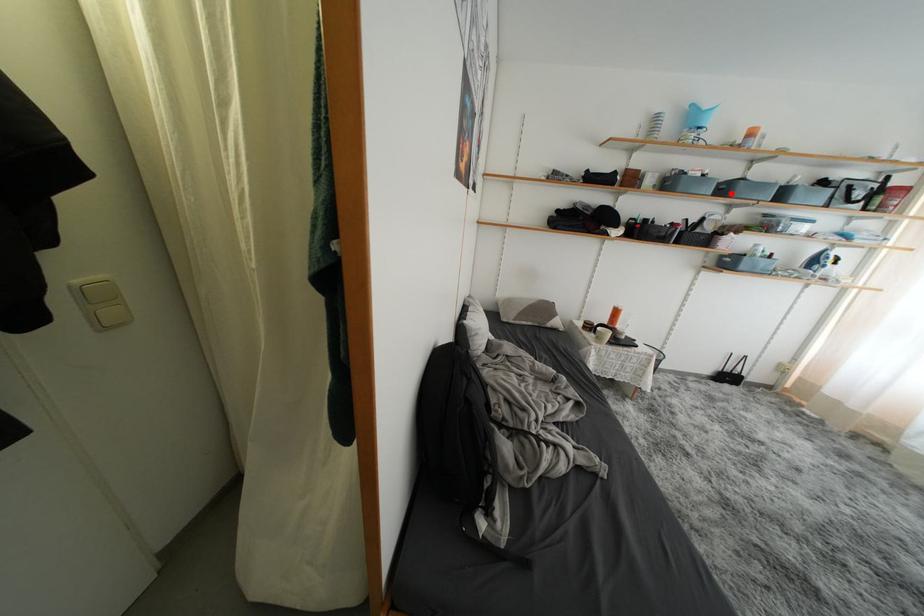
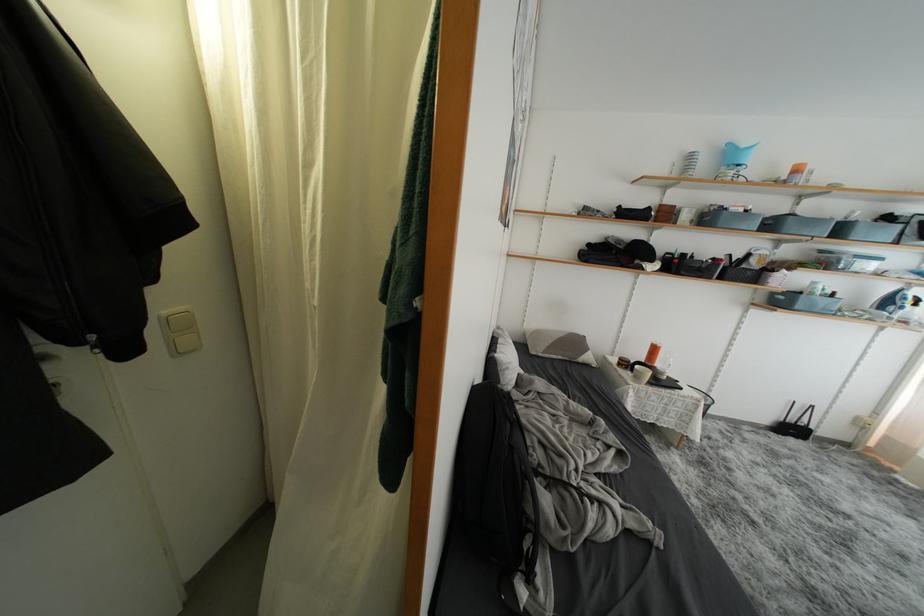
Question: I am providing you with two images of the same scene from different viewpoints. A red point is marked on the first image. At the location where the point appears in image 1, is it still visible in image 2?

Choices:
 (A) Yes
 (B) No

Answer: (A)